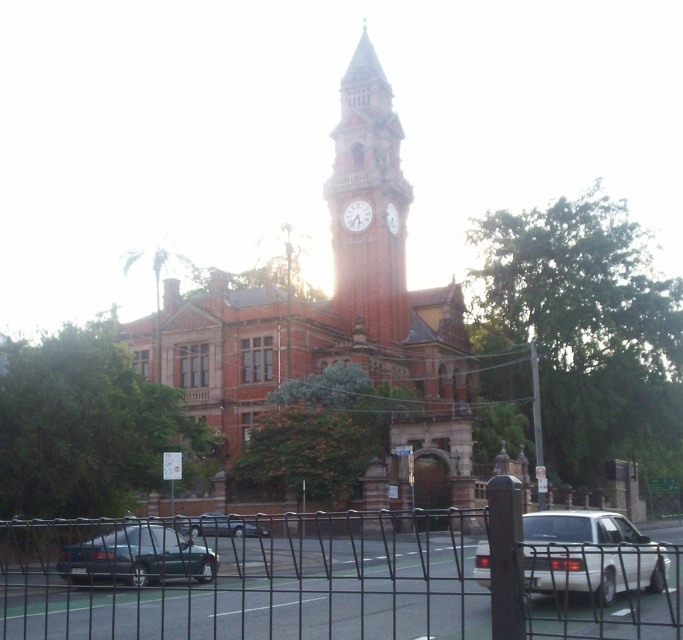
Question: Observing the image, what is the correct spatial positioning of green matte sedan at lower left in reference to metallic silver sedan at lower center?

Choices:
 (A) left
 (B) right

Answer: (A)

Question: Which point is farther to the camera?

Choices:
 (A) white glossy clock at center
 (B) metallic silver sedan at lower center
 (C) metal wire fence at center

Answer: (A)

Question: From the image, what is the correct spatial relationship of white matte sedan at lower right in relation to metallic silver sedan at lower center?

Choices:
 (A) left
 (B) right

Answer: (B)

Question: Which point is closer to the camera?

Choices:
 (A) white glossy clock at center
 (B) metallic silver sedan at lower center
 (C) white matte clock at center
 (D) white matte sedan at lower right

Answer: (D)

Question: Is red brick clock tower at center to the left of white glossy clock at center from the viewer's perspective?

Choices:
 (A) no
 (B) yes

Answer: (A)

Question: Which point is farther to the camera?

Choices:
 (A) white matte sedan at lower right
 (B) white glossy clock at center

Answer: (B)